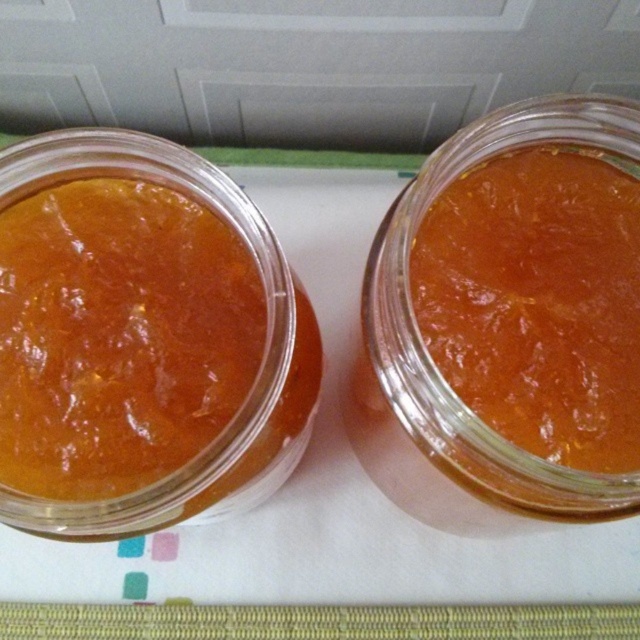
Question: Which of the following is the closest to the observer?

Choices:
 (A) (228, 396)
 (B) (364, 280)

Answer: (A)

Question: Is matte orange jam at left below translucent glass jar at center?

Choices:
 (A) no
 (B) yes

Answer: (A)

Question: Where is matte orange jam at left located in relation to translucent glass jar at center in the image?

Choices:
 (A) right
 (B) left

Answer: (B)

Question: Can you confirm if matte orange jam at left is positioned to the left of translucent glass jar at center?

Choices:
 (A) yes
 (B) no

Answer: (A)

Question: Which of the following is the closest to the observer?

Choices:
 (A) matte orange jam at left
 (B) translucent glass jar at center

Answer: (B)